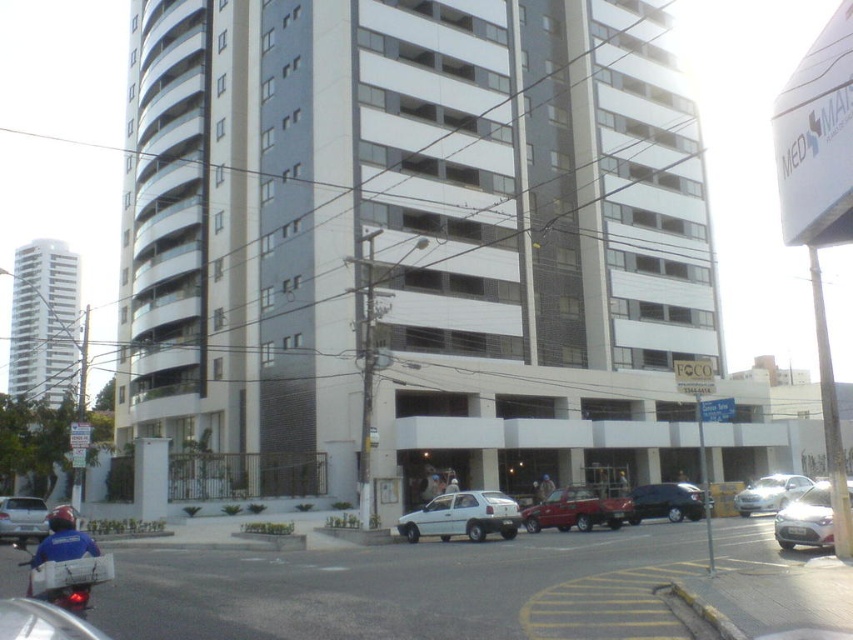
You are a delivery driver who needs to park your vehicle in the parking lot near the building. You see the satin silver sedan at lower right and the shiny black sedan at center. Which vehicle is closer to the entrance of the building?

The satin silver sedan at lower right is closer to the entrance of the building because it is in front of the shiny black sedan at center, which is further away.

You are a delivery driver who needs to park your truck between the satin silver sedan at lower right and the silver metallic sedan at center. Your truck is 6 meters long. Is there enough space between them to park?

The distance between the satin silver sedan at lower right and the silver metallic sedan at center is 5.87 meters. Since your truck is 6 meters long, there isn is not enough space to park between them.

You are a parking attendant who needs to fit a new sedan into the available space. The space is designed for vehicles up to 1.8 meters in width. You see the satin silver sedan at lower right and the silver metallic sedan at center. Which vehicle should you choose to park in the space to ensure it fits?

The satin silver sedan at lower right might be wider than silver metallic sedan at center. Since the space allows up to 1.8 meters, you should choose the silver metallic sedan at center to ensure it fits within the width limit.